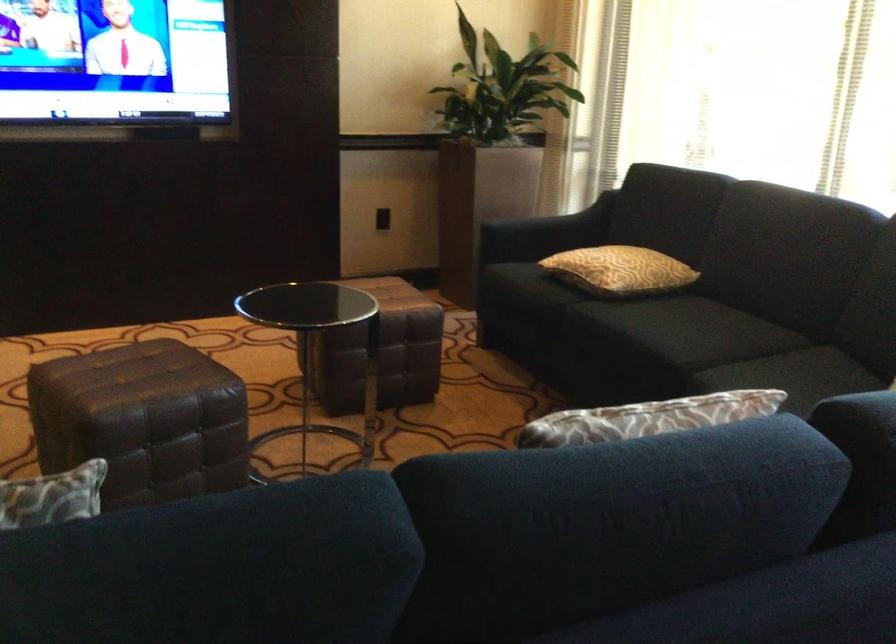
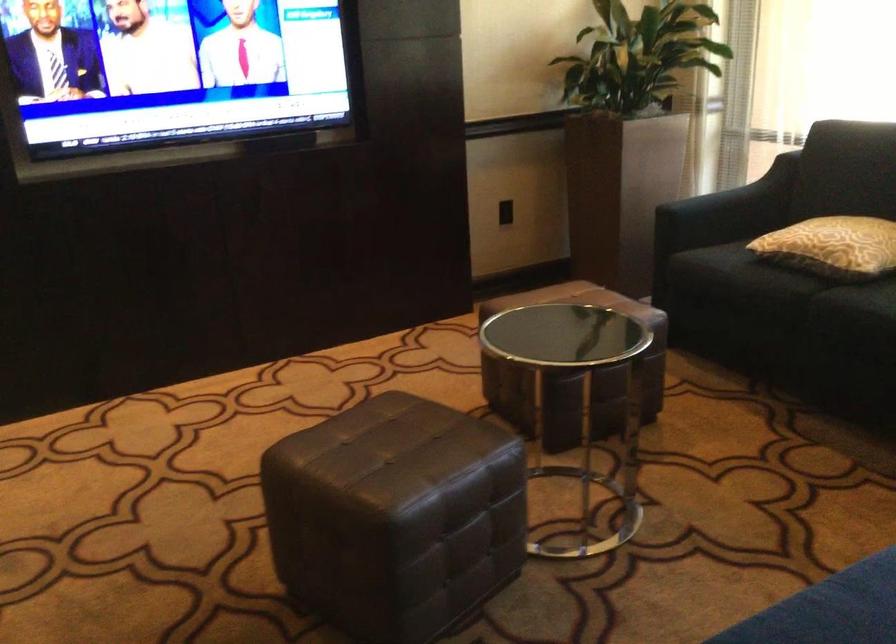
Find the pixel in the second image that matches point 591,269 in the first image.

(832, 245)